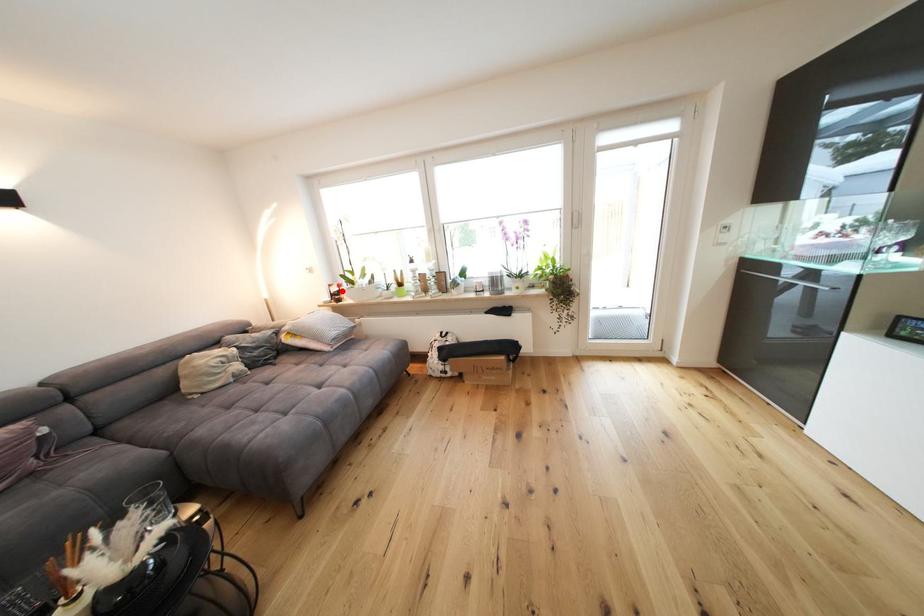
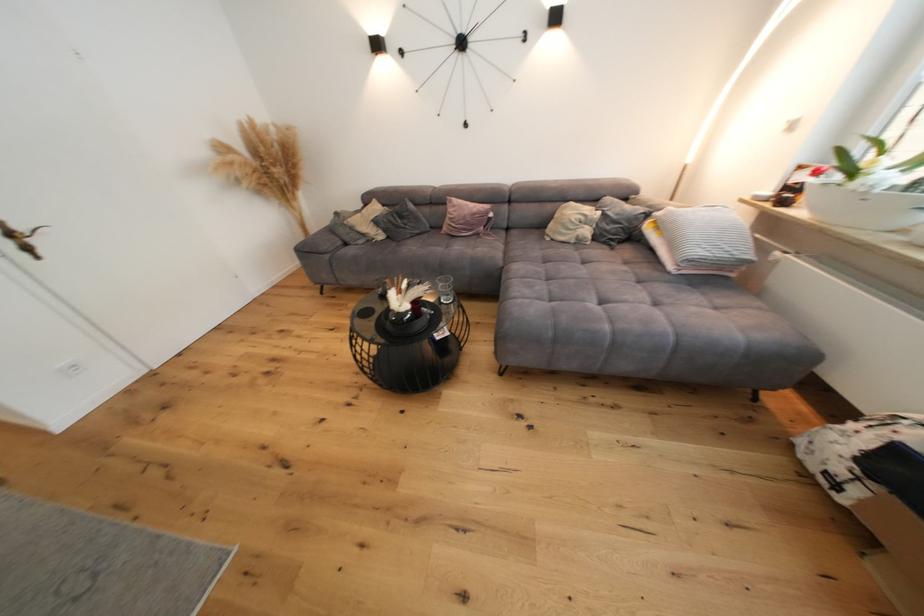
The point at the highlighted location is marked in the first image. Where is the corresponding point in the second image?

(809, 179)